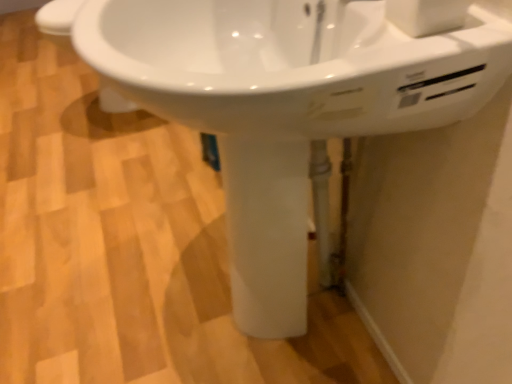
Where is `free space in front of white glossy toilet bowl at lower left`? The height and width of the screenshot is (384, 512). free space in front of white glossy toilet bowl at lower left is located at coordinates (82, 145).